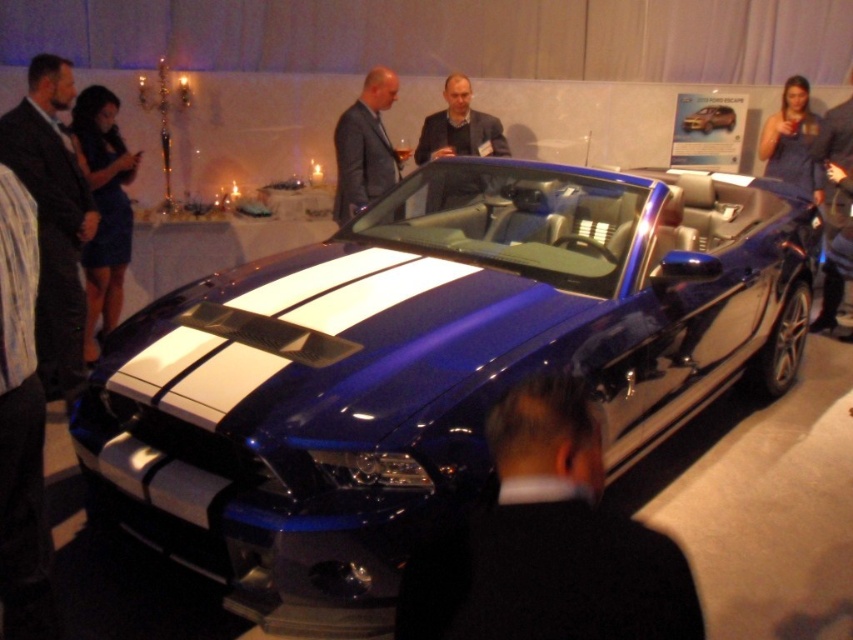
Between point (612, 580) and point (422, 122), which one is positioned behind?

Positioned behind is point (422, 122).

Find the location of `black leather jacket at lower center`. black leather jacket at lower center is located at coordinates (547, 541).

Does dark blue dress at left come in front of dark blue suit at center?

Yes, dark blue dress at left is closer to the viewer.

Can you confirm if dark blue dress at left is positioned to the left of dark blue suit at center?

Yes, dark blue dress at left is to the left of dark blue suit at center.

Who is more forward, (85, 264) or (467, 196)?

Point (467, 196) is in front.

Image resolution: width=853 pixels, height=640 pixels. Identify the location of dark blue dress at left. (103, 208).

Does black leather jacket at lower center have a larger size compared to glossy metallic car at center?

Yes.

Which is in front, point (523, 484) or point (730, 124)?

Point (523, 484) is more forward.

In order to click on black leather jacket at lower center in this screenshot , I will do pyautogui.click(x=547, y=541).